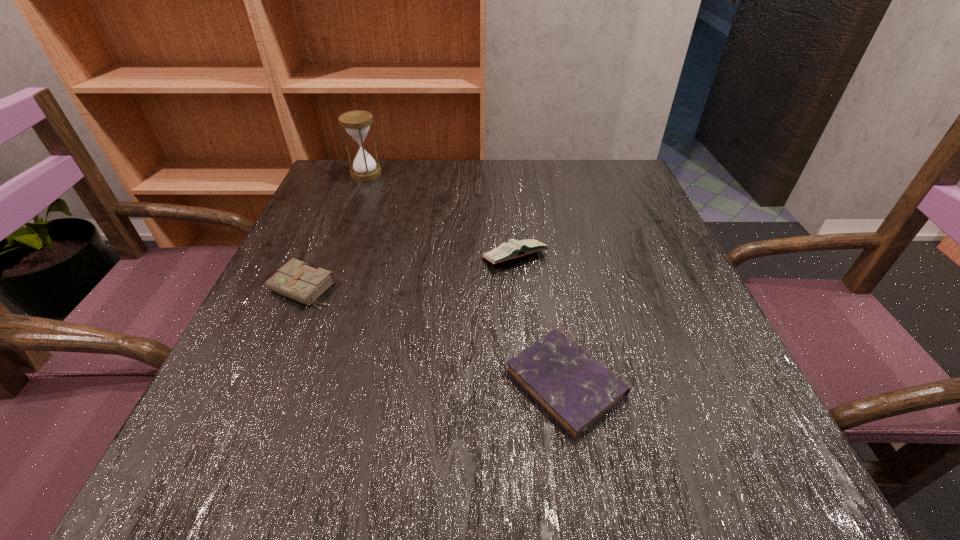
You are a GUI agent. You are given a task and a screenshot of the screen. Output one action in this format:
    pyautogui.click(x=<x>, y=<y>)
    Task: Click on the hourglass
    
    Given the screenshot: What is the action you would take?
    pyautogui.click(x=357, y=123)

You are a GUI agent. You are given a task and a screenshot of the screen. Output one action in this format:
    pyautogui.click(x=<x>, y=<y>)
    Task: Click on the farthest object
    
    Given the screenshot: What is the action you would take?
    pyautogui.click(x=357, y=123)

Locate an element on the screen. The image size is (960, 540). the tallest diary is located at coordinates (513, 249).

Where is `the leftmost diary`? the leftmost diary is located at coordinates (295, 280).

You are a GUI agent. You are given a task and a screenshot of the screen. Output one action in this format:
    pyautogui.click(x=<x>, y=<y>)
    Task: Click on the third tallest object
    The width and height of the screenshot is (960, 540).
    Given the screenshot: What is the action you would take?
    pyautogui.click(x=295, y=280)

This screenshot has height=540, width=960. In order to click on the nearest diary in this screenshot , I will do `click(575, 389)`.

Locate an element on the screen. The height and width of the screenshot is (540, 960). the shortest object is located at coordinates (575, 389).

This screenshot has height=540, width=960. I want to click on vacant space located on the right of the tallest object, so click(x=432, y=173).

Where is `vacant space located on the back of the tallest diary`? vacant space located on the back of the tallest diary is located at coordinates (507, 171).

The height and width of the screenshot is (540, 960). In order to click on vacant area situated on the front of the leftmost diary in this screenshot , I will do `click(237, 439)`.